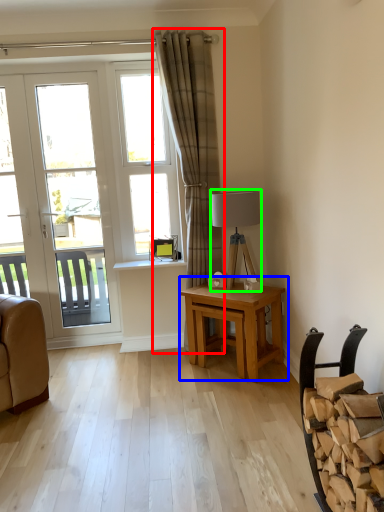
Question: Which object is the farthest from curtain (highlighted by a red box)? Choose among these: table (highlighted by a blue box) or lamp (highlighted by a green box).

Choices:
 (A) table
 (B) lamp

Answer: (A)